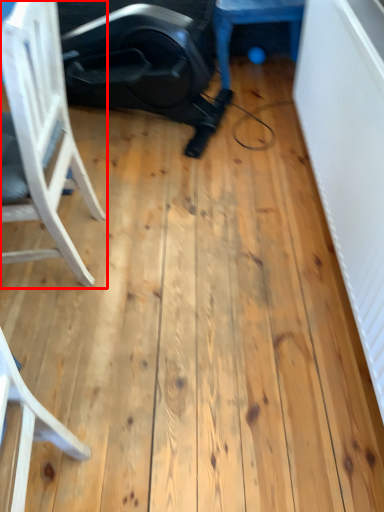
Question: Where is chair (annotated by the red box) located in relation to furniture in the image?

Choices:
 (A) right
 (B) left

Answer: (B)